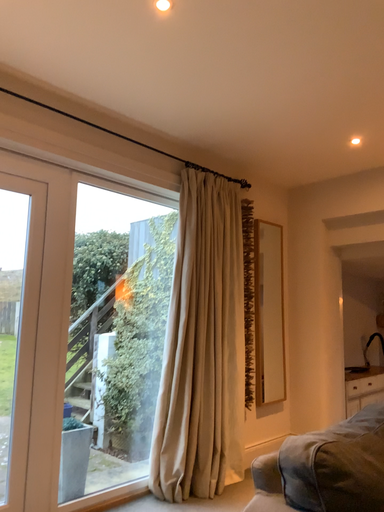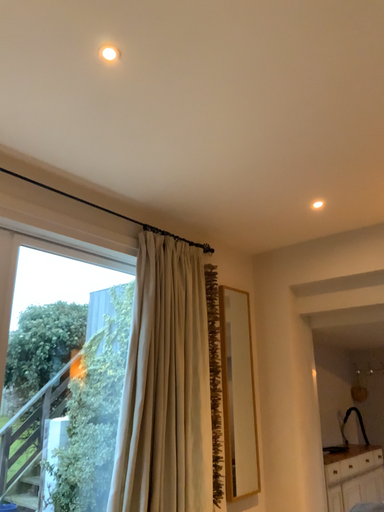
Question: How did the camera likely rotate when shooting the video?

Choices:
 (A) rotated upward
 (B) rotated downward

Answer: (A)